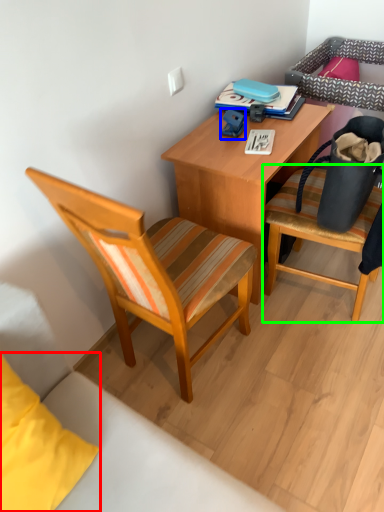
Question: Which object is positioned farthest from pillow (highlighted by a red box)? Select from toy (highlighted by a blue box) and chair (highlighted by a green box).

Choices:
 (A) toy
 (B) chair

Answer: (A)